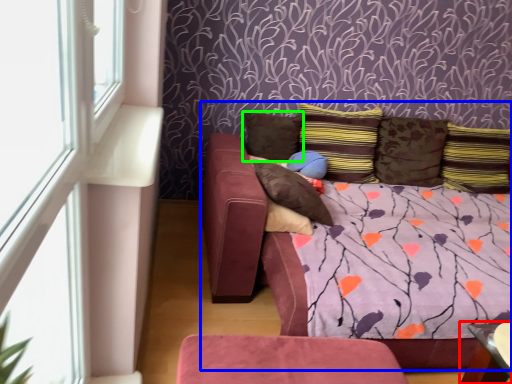
Question: Which object is the farthest from table (highlighted by a red box)? Choose among these: studio couch (highlighted by a blue box) or pillow (highlighted by a green box).

Choices:
 (A) studio couch
 (B) pillow

Answer: (B)